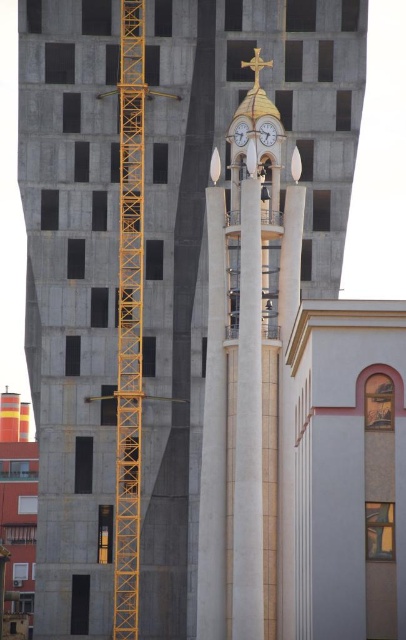
You are a construction worker standing at the base of the modern building. You need to secure a safety net between the yellow metallic crane at left and the metallic gold clock at upper center. Given their positions, can you safely attach the net without it interfering with the crane or the clock?

The yellow metallic crane at left is located below the metallic gold clock at upper center, so the safety net can be secured between them without interfering with either structure.

You are a construction worker who needs to ensure safety by checking if the yellow metallic crane at left can fit through a narrow alley that is only as wide as the metallic gold clock at upper center. Can the crane pass through the alley?

The yellow metallic crane at left is wider than the metallic gold clock at upper center, so it cannot pass through the alley which is only as wide as the clock.